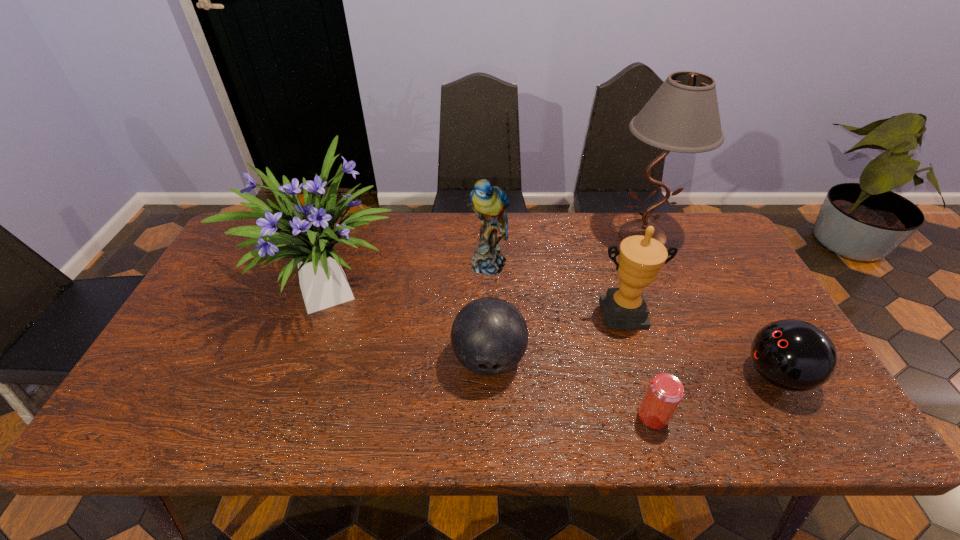
This screenshot has width=960, height=540. I want to click on vacant area located on the face of the parrot, so click(x=491, y=343).

Where is `blank space located at the front of the award with handles`? Image resolution: width=960 pixels, height=540 pixels. blank space located at the front of the award with handles is located at coordinates (659, 433).

Image resolution: width=960 pixels, height=540 pixels. What are the coordinates of `vacant space located 0.210m on the surface of the right bowling ball near the finger holes` in the screenshot? It's located at (656, 375).

At what (x,y) coordinates should I click in order to perform the action: click on vacant space situated on the surface of the right bowling ball near the finger holes. Please return your answer as a coordinate pair (x, y). Looking at the image, I should click on (692, 375).

The width and height of the screenshot is (960, 540). Find the location of `vacant area situated 0.160m on the surface of the right bowling ball near the finger holes`. vacant area situated 0.160m on the surface of the right bowling ball near the finger holes is located at coordinates (676, 375).

Where is `free point located on the left of the beer can`? The width and height of the screenshot is (960, 540). free point located on the left of the beer can is located at coordinates (468, 416).

Identify the location of table lamp that is at the far edge. The height and width of the screenshot is (540, 960). (682, 116).

The image size is (960, 540). Find the location of `flower arrangement positioned at the far edge`. flower arrangement positioned at the far edge is located at coordinates (306, 233).

Find the location of `parrot present at the far edge`. parrot present at the far edge is located at coordinates (489, 202).

Image resolution: width=960 pixels, height=540 pixels. What are the coordinates of `bowling ball positioned at the near edge` in the screenshot? It's located at (794, 355).